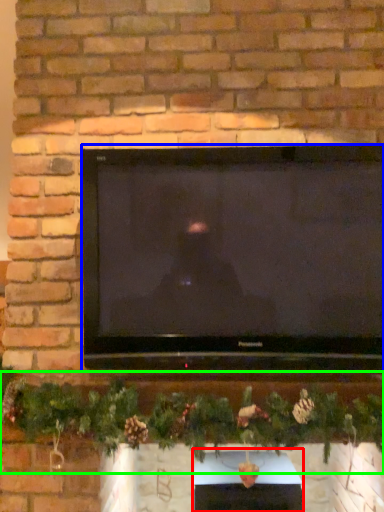
Question: Estimate the real-world distances between objects in this image. Which object is closer to fireplace (highlighted by a red box), television (highlighted by a blue box) or christmas decoration (highlighted by a green box)?

Choices:
 (A) television
 (B) christmas decoration

Answer: (B)